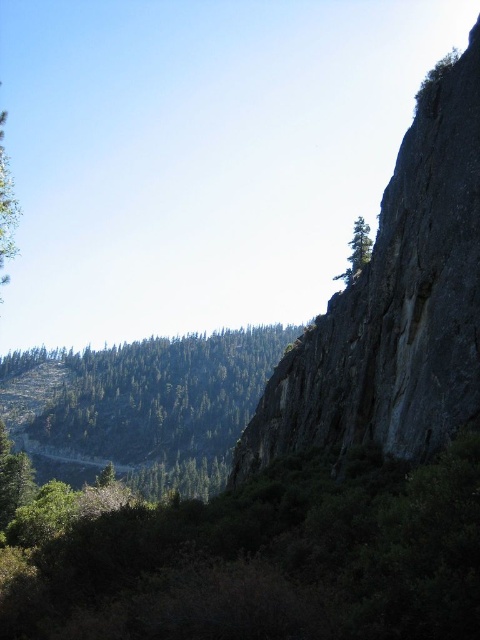
Does green leafy tree at left appear on the right side of green matte tree at upper center?

In fact, green leafy tree at left is to the left of green matte tree at upper center.

Between green leafy tree at left and green matte tree at upper center, which one has less height?

green matte tree at upper center

Is point (2, 262) positioned before point (352, 257)?

Yes, point (2, 262) is in front of point (352, 257).

I want to click on green leafy tree at left, so [x=6, y=205].

Can you confirm if green textured trees at center is wider than green matte tree at upper center?

Yes, green textured trees at center is wider than green matte tree at upper center.

The height and width of the screenshot is (640, 480). I want to click on green textured trees at center, so click(141, 406).

Does green textured trees at center have a smaller size compared to green leafy tree at left?

Indeed, green textured trees at center has a smaller size compared to green leafy tree at left.

Who is taller, green textured trees at center or green leafy tree at left?

green leafy tree at left

Identify the location of green textured trees at center. (141, 406).

Find the location of a particular element. This screenshot has width=480, height=640. green textured trees at center is located at coordinates (141, 406).